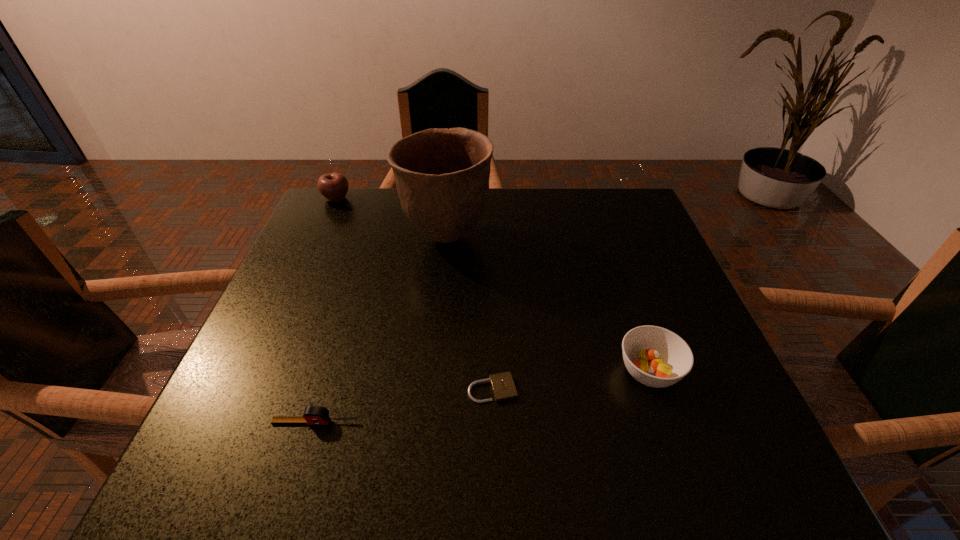
At what (x,y) coordinates should I click in order to perform the action: click on pottery. Please return your answer as a coordinate pair (x, y). Looking at the image, I should click on (442, 176).

Identify the location of the fourth nearest object. (442, 176).

Image resolution: width=960 pixels, height=540 pixels. In order to click on the leftmost object in this screenshot , I will do `click(333, 187)`.

Locate an element on the screen. The image size is (960, 540). the farthest object is located at coordinates (333, 187).

This screenshot has height=540, width=960. I want to click on the third shortest object, so tap(656, 357).

The image size is (960, 540). In order to click on soup bowl in this screenshot , I will do point(656,357).

Identify the location of the fourth object from right to left. The width and height of the screenshot is (960, 540). (312, 415).

The width and height of the screenshot is (960, 540). I want to click on tape measure, so click(312, 415).

You are a GUI agent. You are given a task and a screenshot of the screen. Output one action in this format:
    pyautogui.click(x=<x>, y=<y>)
    Task: Click on the padlock
    The image size is (960, 540).
    Given the screenshot: What is the action you would take?
    pyautogui.click(x=502, y=384)

Locate an element on the screen. The image size is (960, 540). vacant space located 0.180m on the right of the fourth nearest object is located at coordinates (562, 237).